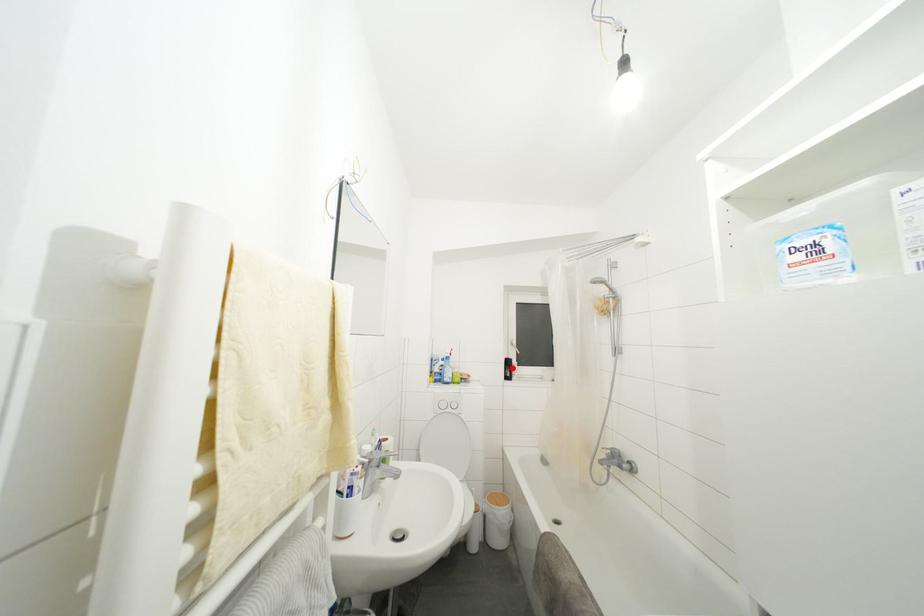
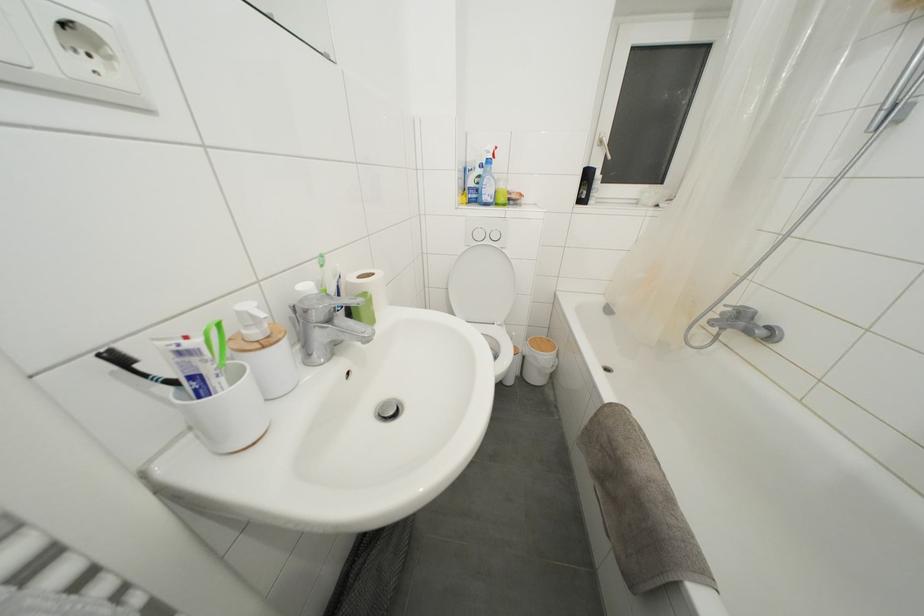
The point at the highlighted location is marked in the first image. Where is the corresponding point in the second image?

(591, 180)